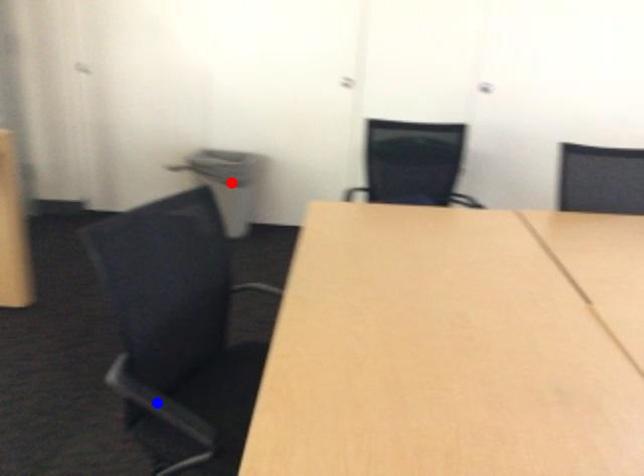
Question: Which of the two points in the image is closer to the camera?

Choices:
 (A) Blue point is closer.
 (B) Red point is closer.

Answer: (A)